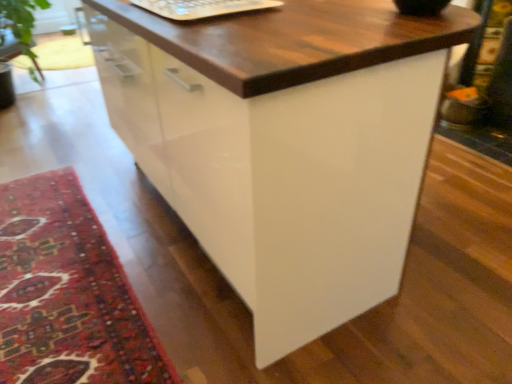
Question: Looking at the image, does white plastic laptop keyboard at upper center seem bigger or smaller compared to carpeted rug at lower left?

Choices:
 (A) small
 (B) big

Answer: (A)

Question: Is white plastic laptop keyboard at upper center situated inside carpeted rug at lower left or outside?

Choices:
 (A) inside
 (B) outside

Answer: (B)

Question: Looking at their shapes, would you say white plastic laptop keyboard at upper center is wider or thinner than carpeted rug at lower left?

Choices:
 (A) wide
 (B) thin

Answer: (B)

Question: From a real-world perspective, is carpeted rug at lower left above or below white plastic laptop keyboard at upper center?

Choices:
 (A) below
 (B) above

Answer: (A)

Question: From the image's perspective, is carpeted rug at lower left above or below white plastic laptop keyboard at upper center?

Choices:
 (A) above
 (B) below

Answer: (B)

Question: Considering the positions of carpeted rug at lower left and white plastic laptop keyboard at upper center in the image, is carpeted rug at lower left taller or shorter than white plastic laptop keyboard at upper center?

Choices:
 (A) short
 (B) tall

Answer: (A)

Question: Is carpeted rug at lower left to the left or to the right of white plastic laptop keyboard at upper center in the image?

Choices:
 (A) right
 (B) left

Answer: (B)